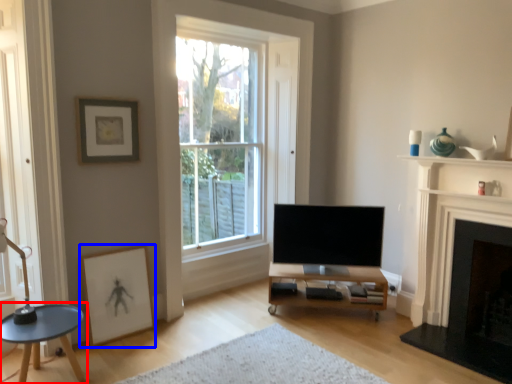
Question: Which object is further to the camera taking this photo, coffee table (highlighted by a red box) or picture frame (highlighted by a blue box)?

Choices:
 (A) coffee table
 (B) picture frame

Answer: (B)